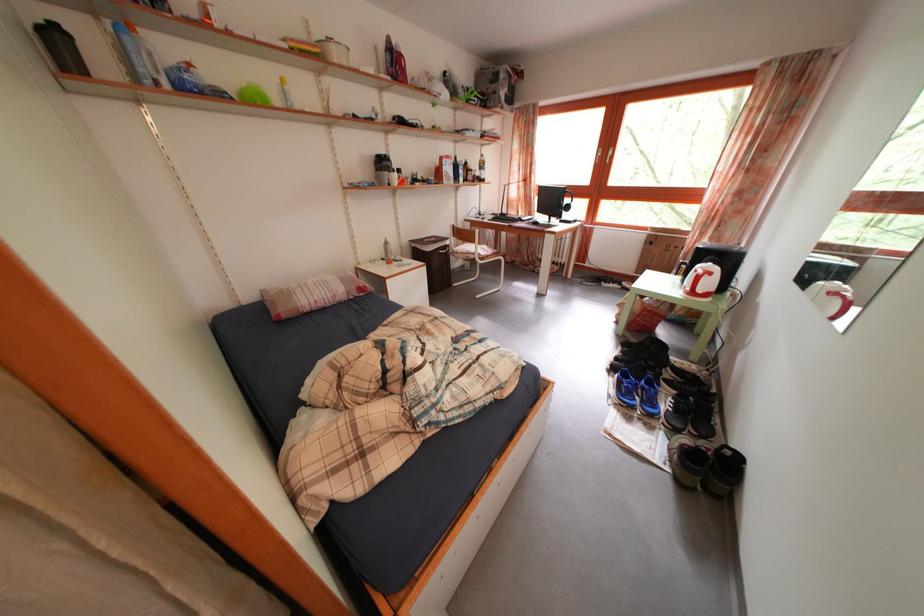
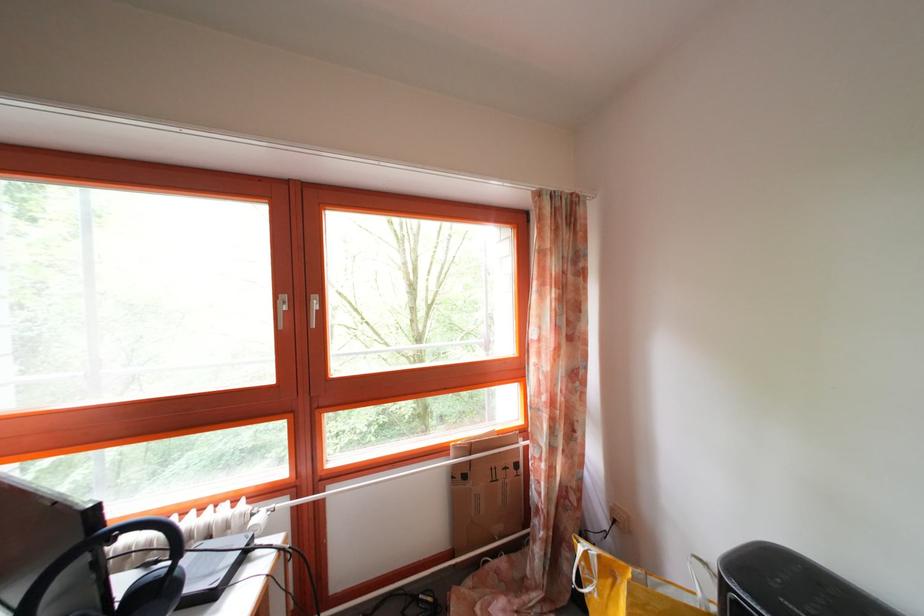
Find the pixel in the second image that matches (x=659, y=251) in the first image.

(472, 484)